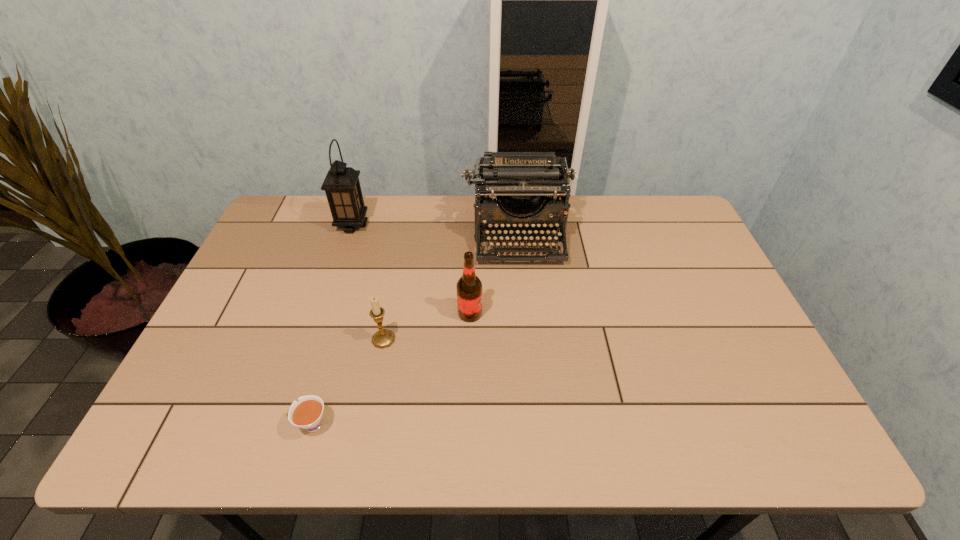
The height and width of the screenshot is (540, 960). What are the coordinates of `vacant region between the typewriter and the teacup` in the screenshot? It's located at (415, 330).

Identify the location of free space that is in between the typewriter and the teacup. Image resolution: width=960 pixels, height=540 pixels. (415, 330).

Where is `vacant space that is in between the typewriter and the candle holder`? vacant space that is in between the typewriter and the candle holder is located at coordinates (451, 287).

Identify the location of the third closest object to the lantern. (469, 287).

Image resolution: width=960 pixels, height=540 pixels. I want to click on object that is the closest to the nearest object, so click(x=384, y=338).

The height and width of the screenshot is (540, 960). Identify the location of vacant area in the image that satisfies the following two spatial constraints: 1. on the front side of the root beer; 2. on the side of the nearest object with the handle. (468, 424).

This screenshot has width=960, height=540. I want to click on vacant space that satisfies the following two spatial constraints: 1. on the front side of the tallest object; 2. on the left side of the second shortest object, so click(315, 339).